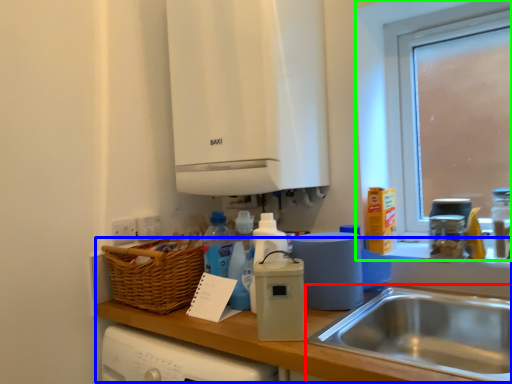
Question: Which object is the farthest from sink (highlighted by a red box)? Choose among these: counter top (highlighted by a blue box) or window (highlighted by a green box).

Choices:
 (A) counter top
 (B) window

Answer: (B)